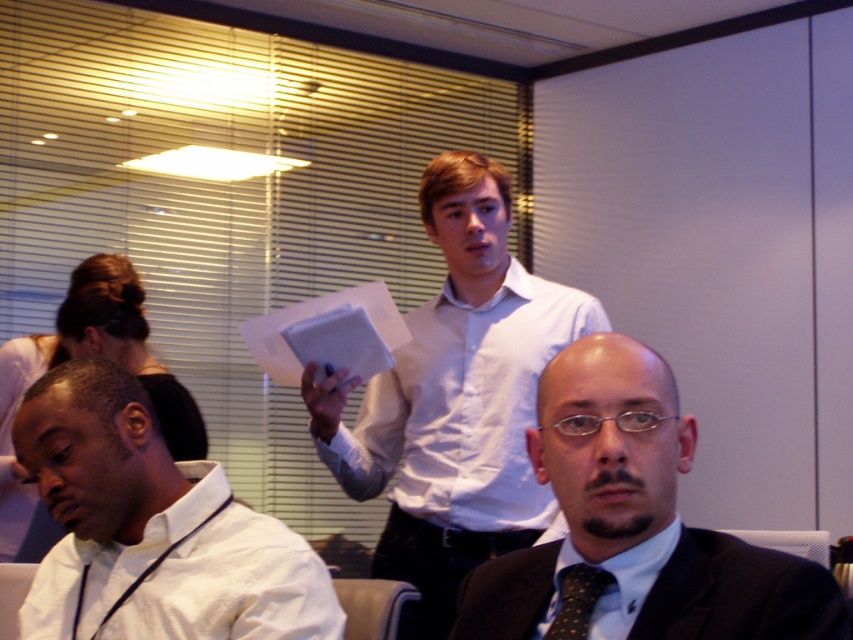
Which is below, white textured shirt at center or white paper at center?

white textured shirt at center is lower down.

Does point (480, 214) come farther from viewer compared to point (283, 385)?

No, (480, 214) is closer to viewer.

Find the location of a particular element. white textured shirt at center is located at coordinates (454, 401).

Can you confirm if dark suit at center is shorter than dark brown textured suit at lower right?

A: In fact, dark suit at center may be taller than dark brown textured suit at lower right.

Is dark suit at center smaller than dark brown textured suit at lower right?

No, dark suit at center is not smaller than dark brown textured suit at lower right.

At what (x,y) coordinates should I click in order to perform the action: click on dark suit at center. Please return your answer as a coordinate pair (x, y). Looking at the image, I should click on (637, 522).

Is white textured shirt at center shorter than dark brown textured suit at lower right?

In fact, white textured shirt at center may be taller than dark brown textured suit at lower right.

Is point (457, 461) positioned after point (839, 621)?

Yes.

Locate an element on the screen. This screenshot has width=853, height=640. white textured shirt at center is located at coordinates (454, 401).

Image resolution: width=853 pixels, height=640 pixels. Find the location of `white textured shirt at center`. white textured shirt at center is located at coordinates (454, 401).